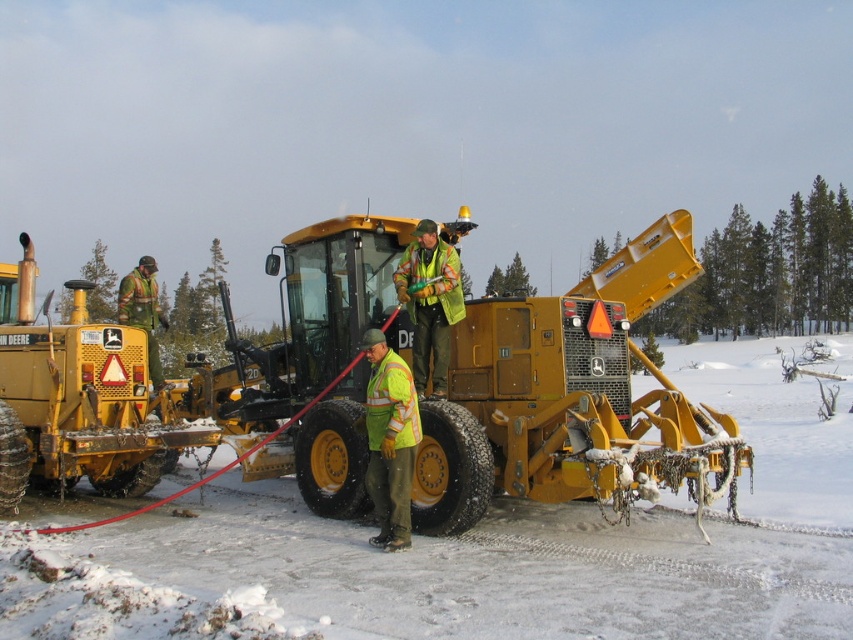
Question: Does matte yellow tractor at center appear on the left side of high-visibility reflective jacket at center?

Choices:
 (A) no
 (B) yes

Answer: (A)

Question: Can you confirm if high-visibility reflective jacket at center is thinner than reflective yellow safety vest at center?

Choices:
 (A) no
 (B) yes

Answer: (B)

Question: Is matte yellow tractor at center above reflective yellow safety vest at center?

Choices:
 (A) no
 (B) yes

Answer: (A)

Question: Which point is farther from the camera taking this photo?

Choices:
 (A) (373, 490)
 (B) (624, 332)
 (C) (457, 282)

Answer: (B)

Question: Which object is closer to the camera taking this photo?

Choices:
 (A) reflective yellow safety vest at center
 (B) matte yellow tractor at center

Answer: (B)

Question: Which is farther from the high-visibility reflective jacket at center?

Choices:
 (A) matte yellow tractor at center
 (B) reflective yellow safety vest at center

Answer: (A)